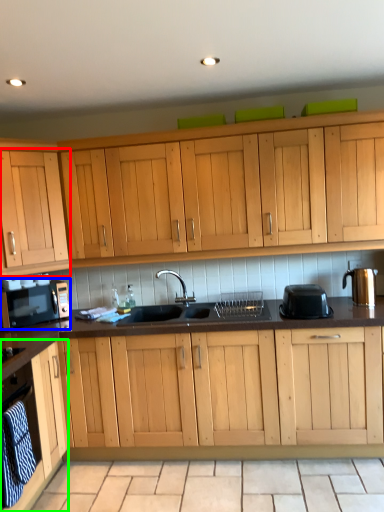
Question: Considering the real-world distances, which object is farthest from cabinetry (highlighted by a red box)? home appliance (highlighted by a blue box) or cabinetry (highlighted by a green box)?

Choices:
 (A) home appliance
 (B) cabinetry

Answer: (B)